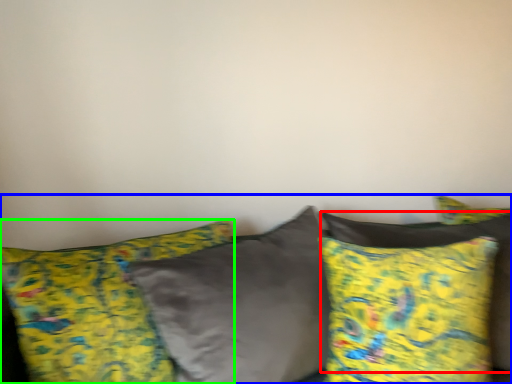
Question: Which is nearer to the pillow (highlighted by a red box)? studio couch (highlighted by a blue box) or pillow (highlighted by a green box).

Choices:
 (A) studio couch
 (B) pillow

Answer: (A)